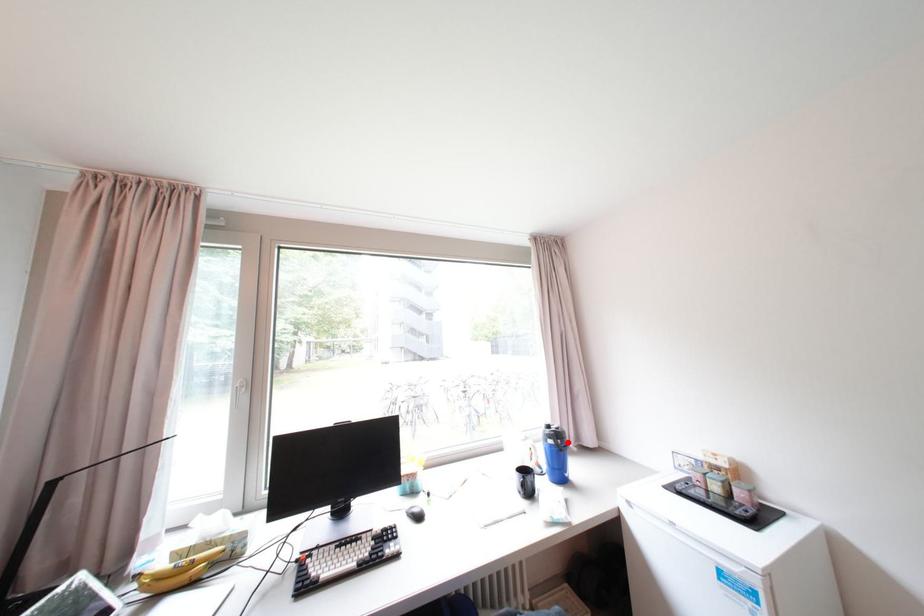
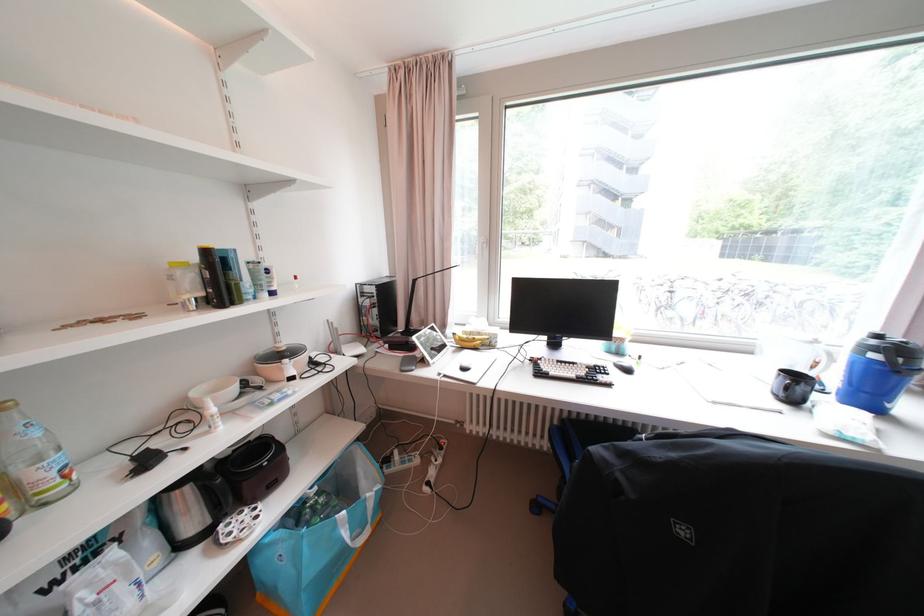
In the second image, find the point that corresponds to the highlighted location in the first image.

(909, 361)